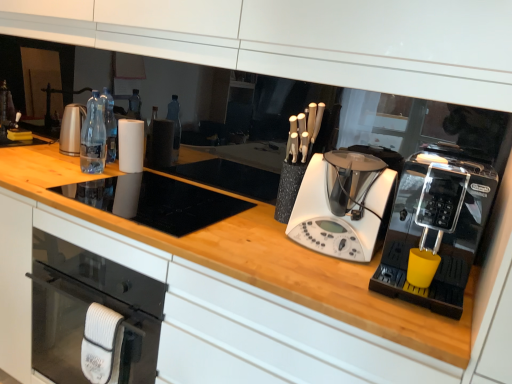
At what (x,y) coordinates should I click in order to perform the action: click on clear plastic bottles at center. Please return your answer as a coordinate pair (x, y). The width and height of the screenshot is (512, 384). Looking at the image, I should click on (93, 137).

Find the location of a particular element. Image resolution: width=512 pixels, height=384 pixels. white matte paper towel at center is located at coordinates (131, 145).

This screenshot has width=512, height=384. In order to click on black plastic coffee machine at right, arranged as the second home appliance when viewed from the left in this screenshot , I will do `click(437, 224)`.

Based on their positions, is clear plastic bottles at center located to the left or right of white plastic blender at center, which ranks as the 1th home appliance in left-to-right order?

clear plastic bottles at center is to the left of white plastic blender at center, which ranks as the 1th home appliance in left-to-right order.

From a real-world perspective, who is located lower, clear plastic bottles at center or white plastic blender at center, which ranks as the 1th home appliance in left-to-right order?

From a 3D spatial view, white plastic blender at center, which ranks as the 1th home appliance in left-to-right order, is below.

Between clear plastic bottles at center and white plastic blender at center, which ranks as the 1th home appliance in left-to-right order, which one is positioned in front?

white plastic blender at center, which ranks as the 1th home appliance in left-to-right order.

Is clear plastic bottles at center not inside white plastic blender at center, acting as the second home appliance starting from the right?

Absolutely, clear plastic bottles at center is external to white plastic blender at center, acting as the second home appliance starting from the right.

From the image's perspective, which object appears higher, white plastic blender at center, which ranks as the 1th home appliance in left-to-right order, or black plastic coffee machine at right, which is the 1th home appliance from right to left?

white plastic blender at center, which ranks as the 1th home appliance in left-to-right order, from the image's perspective.

I want to click on home appliance located underneath the black plastic coffee machine at right, arranged as the second home appliance when viewed from the left (from a real-world perspective), so click(342, 204).

Considering the sizes of white plastic blender at center, which ranks as the 1th home appliance in left-to-right order, and black plastic coffee machine at right, arranged as the second home appliance when viewed from the left, in the image, is white plastic blender at center, which ranks as the 1th home appliance in left-to-right order, bigger or smaller than black plastic coffee machine at right, arranged as the second home appliance when viewed from the left,?

Considering their sizes, white plastic blender at center, which ranks as the 1th home appliance in left-to-right order, takes up less space than black plastic coffee machine at right, arranged as the second home appliance when viewed from the left.

Is white plastic blender at center, acting as the second home appliance starting from the right, inside the boundaries of black plastic coffee machine at right, which is the 1th home appliance from right to left, or outside?

white plastic blender at center, acting as the second home appliance starting from the right, is outside black plastic coffee machine at right, which is the 1th home appliance from right to left.

You are a GUI agent. You are given a task and a screenshot of the screen. Output one action in this format:
    pyautogui.click(x=<x>, y=<y>)
    Task: Click on the 1st home appliance positioned below the white matte paper towel at center (from the image's perspective)
    The height and width of the screenshot is (384, 512).
    Given the screenshot: What is the action you would take?
    pyautogui.click(x=342, y=204)

Considering the sizes of objects white plastic blender at center, acting as the second home appliance starting from the right, and white matte paper towel at center in the image provided, who is smaller, white plastic blender at center, acting as the second home appliance starting from the right, or white matte paper towel at center?

With smaller size is white matte paper towel at center.

From the image's perspective, is white plastic blender at center, acting as the second home appliance starting from the right, located above white matte paper towel at center?

No, from the image's perspective, white plastic blender at center, acting as the second home appliance starting from the right, is not over white matte paper towel at center.

You are a GUI agent. You are given a task and a screenshot of the screen. Output one action in this format:
    pyautogui.click(x=<x>, y=<y>)
    Task: Click on the paper towel that appears behind the black plastic coffee machine at right, arranged as the second home appliance when viewed from the left
    Image resolution: width=512 pixels, height=384 pixels.
    Given the screenshot: What is the action you would take?
    pyautogui.click(x=131, y=145)

Is black plastic coffee machine at right, arranged as the second home appliance when viewed from the left, in front of or behind white matte paper towel at center in the image?

Visually, black plastic coffee machine at right, arranged as the second home appliance when viewed from the left, is located in front of white matte paper towel at center.

Considering the points (433, 247) and (123, 132), which point is in front, point (433, 247) or point (123, 132)?

Point (433, 247)

From their relative heights in the image, would you say black plastic coffee machine at right, which is the 1th home appliance from right to left, is taller or shorter than white plastic blender at center, acting as the second home appliance starting from the right?

Considering their sizes, black plastic coffee machine at right, which is the 1th home appliance from right to left, has more height than white plastic blender at center, acting as the second home appliance starting from the right.

Which object is closer to the camera taking this photo, black plastic coffee machine at right, arranged as the second home appliance when viewed from the left, or white plastic blender at center, acting as the second home appliance starting from the right?

black plastic coffee machine at right, arranged as the second home appliance when viewed from the left, is closer to the camera.

Can you tell me how much black plastic coffee machine at right, which is the 1th home appliance from right to left, and white plastic blender at center, acting as the second home appliance starting from the right, differ in facing direction?

black plastic coffee machine at right, which is the 1th home appliance from right to left, and white plastic blender at center, acting as the second home appliance starting from the right, are facing 0.000409 degrees away from each other.

You are a GUI agent. You are given a task and a screenshot of the screen. Output one action in this format:
    pyautogui.click(x=<x>, y=<y>)
    Task: Click on the home appliance below the white plastic blender at center, acting as the second home appliance starting from the right (from the image's perspective)
    This screenshot has width=512, height=384.
    Given the screenshot: What is the action you would take?
    [x=437, y=224]

Considering the relative sizes of white plastic blender at center, acting as the second home appliance starting from the right, and clear plastic bottles at center in the image provided, is white plastic blender at center, acting as the second home appliance starting from the right, taller than clear plastic bottles at center?

No, white plastic blender at center, acting as the second home appliance starting from the right, is not taller than clear plastic bottles at center.

Is white plastic blender at center, which ranks as the 1th home appliance in left-to-right order, completely or partially outside of clear plastic bottles at center?

white plastic blender at center, which ranks as the 1th home appliance in left-to-right order, is positioned outside clear plastic bottles at center.

Considering the positions of objects white plastic blender at center, which ranks as the 1th home appliance in left-to-right order, and clear plastic bottles at center in the image provided, who is more to the right, white plastic blender at center, which ranks as the 1th home appliance in left-to-right order, or clear plastic bottles at center?

white plastic blender at center, which ranks as the 1th home appliance in left-to-right order.

How different are the orientations of white plastic blender at center, acting as the second home appliance starting from the right, and clear plastic bottles at center in degrees?

29.2 degrees separate the facing orientations of white plastic blender at center, acting as the second home appliance starting from the right, and clear plastic bottles at center.

Is the position of white matte paper towel at center more distant than that of white plastic blender at center, which ranks as the 1th home appliance in left-to-right order?

Yes.

From a real-world perspective, which is physically above, white matte paper towel at center or white plastic blender at center, acting as the second home appliance starting from the right?

white plastic blender at center, acting as the second home appliance starting from the right.

Is white matte paper towel at center to the left of white plastic blender at center, which ranks as the 1th home appliance in left-to-right order, from the viewer's perspective?

Indeed, white matte paper towel at center is positioned on the left side of white plastic blender at center, which ranks as the 1th home appliance in left-to-right order.

Is white matte paper towel at center located outside white plastic blender at center, which ranks as the 1th home appliance in left-to-right order?

Yes, white matte paper towel at center is outside of white plastic blender at center, which ranks as the 1th home appliance in left-to-right order.

Identify the location of the 1st home appliance below the clear plastic bottles at center (from the image's perspective). (342, 204).

Where is `home appliance in front of the white plastic blender at center, acting as the second home appliance starting from the right`? Image resolution: width=512 pixels, height=384 pixels. home appliance in front of the white plastic blender at center, acting as the second home appliance starting from the right is located at coordinates (437, 224).

When comparing their distances from white matte paper towel at center, does white plastic blender at center, acting as the second home appliance starting from the right, or clear plastic bottles at center seem closer?

Among the two, clear plastic bottles at center is located nearer to white matte paper towel at center.

Looking at the image, which one is located further to white plastic blender at center, which ranks as the 1th home appliance in left-to-right order, clear plastic bottles at center or black plastic coffee machine at right, arranged as the second home appliance when viewed from the left?

The object further to white plastic blender at center, which ranks as the 1th home appliance in left-to-right order, is clear plastic bottles at center.

When comparing their distances from black plastic coffee machine at right, which is the 1th home appliance from right to left, does white matte paper towel at center or white plastic blender at center, which ranks as the 1th home appliance in left-to-right order, seem further?

Among the two, white matte paper towel at center is located further to black plastic coffee machine at right, which is the 1th home appliance from right to left.

Which object lies nearer to the anchor point black plastic coffee machine at right, arranged as the second home appliance when viewed from the left, white plastic blender at center, acting as the second home appliance starting from the right, or white matte paper towel at center?

Among the two, white plastic blender at center, acting as the second home appliance starting from the right, is located nearer to black plastic coffee machine at right, arranged as the second home appliance when viewed from the left.

When comparing their distances from white plastic blender at center, which ranks as the 1th home appliance in left-to-right order, does black plastic coffee machine at right, arranged as the second home appliance when viewed from the left, or white matte paper towel at center seem closer?

Among the two, black plastic coffee machine at right, arranged as the second home appliance when viewed from the left, is located nearer to white plastic blender at center, which ranks as the 1th home appliance in left-to-right order.

From the image, which object appears to be nearer to black plastic coffee machine at right, arranged as the second home appliance when viewed from the left, clear plastic bottles at center or white matte paper towel at center?

white matte paper towel at center.

From the image, which object appears to be farther from black plastic coffee machine at right, which is the 1th home appliance from right to left, clear plastic bottles at center or white plastic blender at center, which ranks as the 1th home appliance in left-to-right order?

clear plastic bottles at center is further to black plastic coffee machine at right, which is the 1th home appliance from right to left.

Considering their positions, is white plastic blender at center, which ranks as the 1th home appliance in left-to-right order, positioned closer to black plastic coffee machine at right, which is the 1th home appliance from right to left, than clear plastic bottles at center?

white plastic blender at center, which ranks as the 1th home appliance in left-to-right order, is closer to black plastic coffee machine at right, which is the 1th home appliance from right to left.

You are a GUI agent. You are given a task and a screenshot of the screen. Output one action in this format:
    pyautogui.click(x=<x>, y=<y>)
    Task: Click on the home appliance situated between clear plastic bottles at center and black plastic coffee machine at right, which is the 1th home appliance from right to left, from left to right
    Image resolution: width=512 pixels, height=384 pixels.
    Given the screenshot: What is the action you would take?
    pyautogui.click(x=342, y=204)

This screenshot has height=384, width=512. I want to click on paper towel located between clear plastic bottles at center and black plastic coffee machine at right, which is the 1th home appliance from right to left, in the left-right direction, so click(x=131, y=145).

Find the location of `home appliance between white matte paper towel at center and black plastic coffee machine at right, arranged as the second home appliance when viewed from the left, in the horizontal direction`. home appliance between white matte paper towel at center and black plastic coffee machine at right, arranged as the second home appliance when viewed from the left, in the horizontal direction is located at coordinates (342, 204).

In order to click on paper towel between clear plastic bottles at center and white plastic blender at center, acting as the second home appliance starting from the right in this screenshot , I will do `click(131, 145)`.